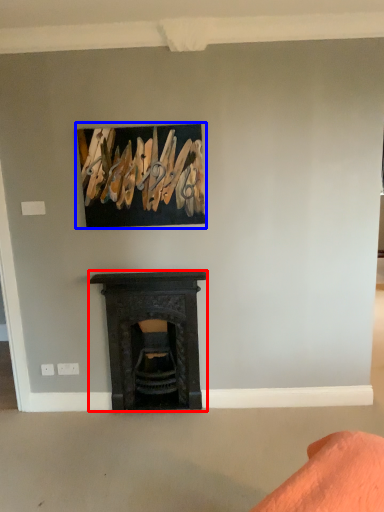
Question: Which of the following is the closest to the observer, fireplace (highlighted by a red box) or picture frame (highlighted by a blue box)?

Choices:
 (A) fireplace
 (B) picture frame

Answer: (B)